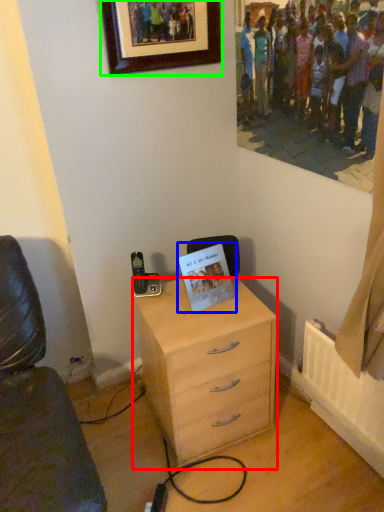
Question: Based on their relative distances, which object is farther from chest of drawers (highlighted by a red box)? Choose from postcard (highlighted by a blue box) and picture frame (highlighted by a green box).

Choices:
 (A) postcard
 (B) picture frame

Answer: (B)